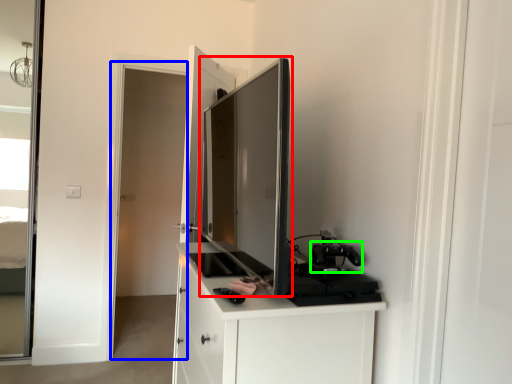
Question: Which object is the farthest from appliance (highlighted by a red box)? Choose among these: screen door (highlighted by a blue box) or appliance (highlighted by a green box).

Choices:
 (A) screen door
 (B) appliance

Answer: (A)